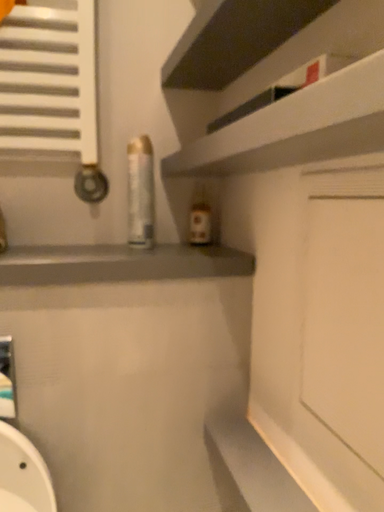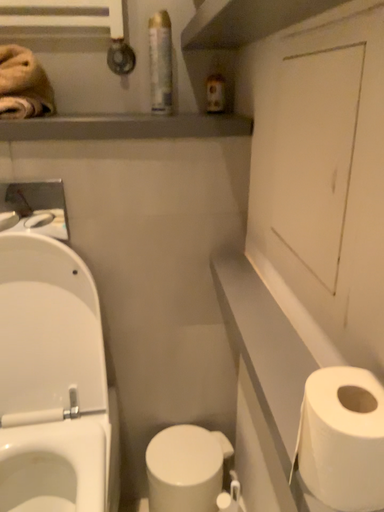
Question: How did the camera likely rotate when shooting the video?

Choices:
 (A) rotated upward
 (B) rotated downward

Answer: (B)